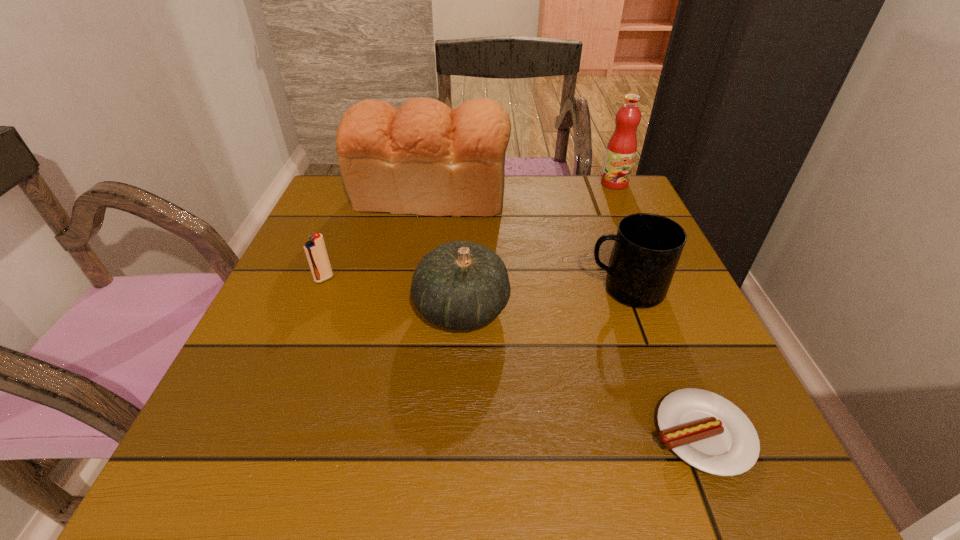
Image resolution: width=960 pixels, height=540 pixels. In order to click on bread in this screenshot , I will do `click(424, 158)`.

I want to click on fruit juice, so click(x=621, y=149).

Locate an element on the screen. The width and height of the screenshot is (960, 540). gourd is located at coordinates (460, 285).

Where is `mug`? Image resolution: width=960 pixels, height=540 pixels. mug is located at coordinates (647, 248).

Where is `igniter`? Image resolution: width=960 pixels, height=540 pixels. igniter is located at coordinates (315, 249).

You are a GUI agent. You are given a task and a screenshot of the screen. Output one action in this format:
    pyautogui.click(x=<x>, y=<y>)
    Task: Click on the shortest object
    The height and width of the screenshot is (540, 960).
    Given the screenshot: What is the action you would take?
    pyautogui.click(x=710, y=433)

Where is `the nearest object`? the nearest object is located at coordinates (710, 433).

Identify the location of free location located on the right of the bread. Image resolution: width=960 pixels, height=540 pixels. (631, 197).

Find the location of a particular element. The width and height of the screenshot is (960, 540). free region located on the front label of the fruit juice is located at coordinates (663, 289).

At what (x,y) coordinates should I click in order to perform the action: click on vacant point located on the right of the gourd. Please return your answer as a coordinate pair (x, y). This screenshot has height=540, width=960. Looking at the image, I should click on (577, 308).